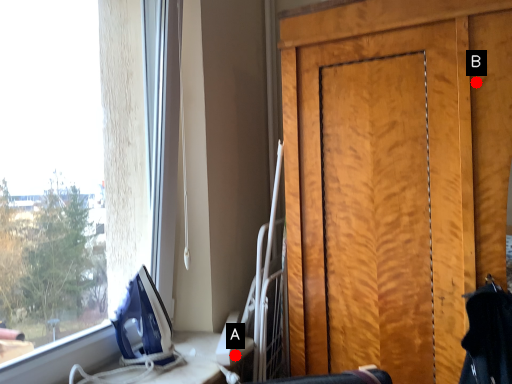
Question: Two points are circled on the image, labeled by A and B beside each circle. Among these points, which one is farthest from the camera?

Choices:
 (A) A is further
 (B) B is further

Answer: (A)